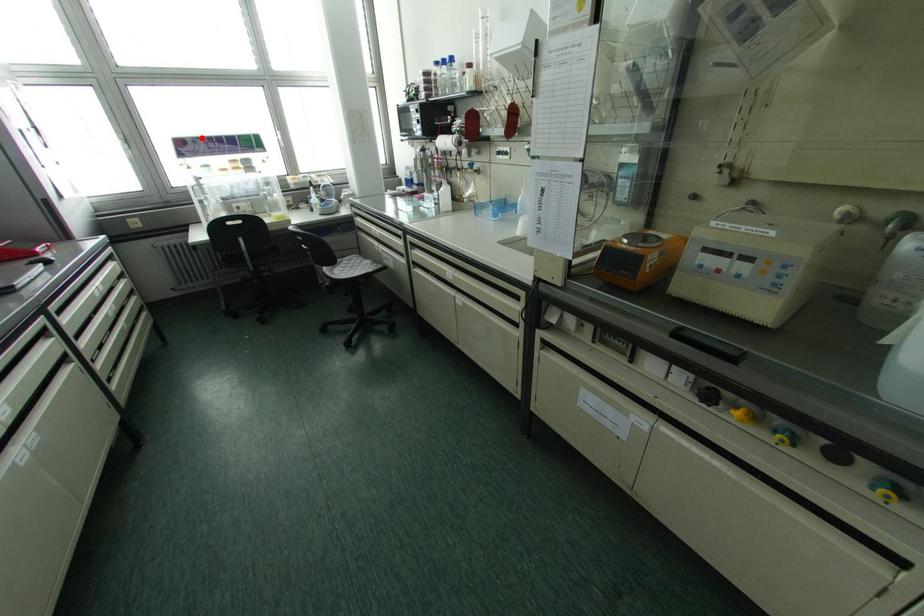
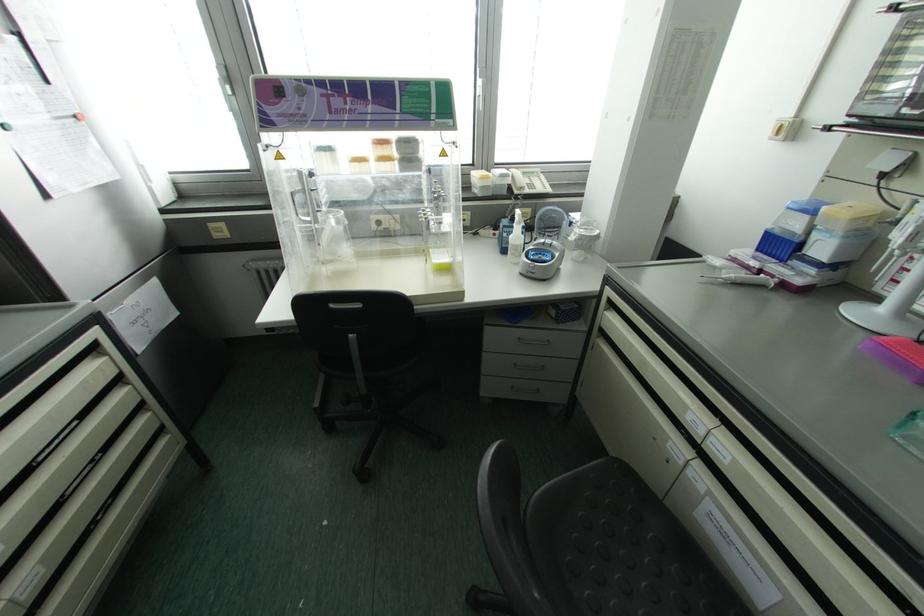
In the second image, find the point that corresponds to the highlighted location in the first image.

(320, 82)